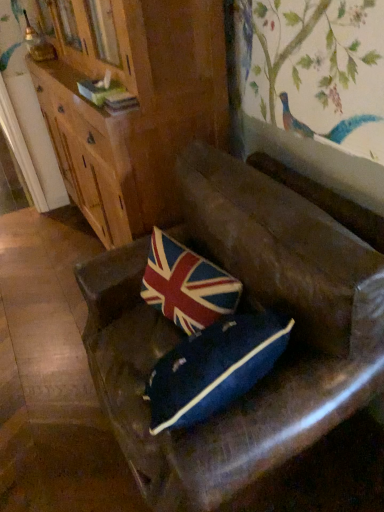
Measure the distance between point (256, 426) and camera.

The depth of point (256, 426) is 37.91 inches.

Where is `wooden cabinet at upper left`? wooden cabinet at upper left is located at coordinates (132, 105).

Measure the distance between wooden cabinet at upper left and camera.

4.21 feet.

Where is `leather couch at center`? The image size is (384, 512). leather couch at center is located at coordinates (243, 309).

Between point (141, 149) and point (283, 305), which one is positioned behind?

The point (141, 149) is more distant.

Is wooden cabinet at upper left bigger than leather couch at center?

Yes.

Is wooden cabinet at upper left in front of leather couch at center?

No, wooden cabinet at upper left is further to the viewer.

Can you see wooden cabinet at upper left touching leather couch at center?

No, wooden cabinet at upper left is not making contact with leather couch at center.

Which object is positioned more to the right, leather couch at center or wooden cabinet at upper left?

leather couch at center is more to the right.

Which object is wider, leather couch at center or wooden cabinet at upper left?

leather couch at center.

Is leather couch at center positioned beyond the bounds of wooden cabinet at upper left?

That's correct, leather couch at center is outside of wooden cabinet at upper left.

Can you confirm if union jack fabric pillow at center is shorter than wooden cabinet at upper left?

Indeed, union jack fabric pillow at center has a lesser height compared to wooden cabinet at upper left.

The width and height of the screenshot is (384, 512). I want to click on cabinetry above the union jack fabric pillow at center (from a real-world perspective), so click(x=132, y=105).

Is union jack fabric pillow at center turned away from wooden cabinet at upper left?

That's not correct — union jack fabric pillow at center is not looking away from wooden cabinet at upper left.

Does union jack fabric pillow at center have a greater height compared to leather couch at center?

No.

Between union jack fabric pillow at center and leather couch at center, which one is positioned in front?

leather couch at center.

Does point (152, 293) come in front of point (377, 317)?

That is False.

Does union jack fabric pillow at center have a larger size compared to leather couch at center?

Incorrect, union jack fabric pillow at center is not larger than leather couch at center.

Considering the sizes of leather couch at center and union jack fabric pillow at center in the image, is leather couch at center taller or shorter than union jack fabric pillow at center?

In the image, leather couch at center appears to be taller than union jack fabric pillow at center.

Is leather couch at center located outside union jack fabric pillow at center?

leather couch at center lies outside union jack fabric pillow at center's area.

Considering the relative sizes of leather couch at center and union jack fabric pillow at center in the image provided, is leather couch at center thinner than union jack fabric pillow at center?

In fact, leather couch at center might be wider than union jack fabric pillow at center.

Is leather couch at center oriented towards union jack fabric pillow at center?

Yes, leather couch at center faces towards union jack fabric pillow at center.

From the image's perspective, which is below, wooden cabinet at upper left or union jack fabric pillow at center?

From the image's view, union jack fabric pillow at center is below.

Does wooden cabinet at upper left touch union jack fabric pillow at center?

No, wooden cabinet at upper left is not with union jack fabric pillow at center.

Is wooden cabinet at upper left behind union jack fabric pillow at center?

That is True.

Find the location of `cabinetry that appears above the leather couch at center (from a real-world perspective)`. cabinetry that appears above the leather couch at center (from a real-world perspective) is located at coordinates (132, 105).

Locate an element on the screen. furniture beneath the wooden cabinet at upper left (from a real-world perspective) is located at coordinates (243, 309).

Estimate the real-world distances between objects in this image. Which object is further from leather couch at center, wooden cabinet at upper left or union jack fabric pillow at center?

Among the two, wooden cabinet at upper left is located further to leather couch at center.

From the image, which object appears to be farther from union jack fabric pillow at center, wooden cabinet at upper left or leather couch at center?

wooden cabinet at upper left.

Considering their positions, is leather couch at center positioned closer to union jack fabric pillow at center than wooden cabinet at upper left?

The object closer to union jack fabric pillow at center is leather couch at center.

Based on their spatial positions, is leather couch at center or union jack fabric pillow at center closer to wooden cabinet at upper left?

union jack fabric pillow at center lies closer to wooden cabinet at upper left than the other object.

From the image, which object appears to be farther from wooden cabinet at upper left, union jack fabric pillow at center or leather couch at center?

leather couch at center.

Which object lies further to the anchor point leather couch at center, union jack fabric pillow at center or wooden cabinet at upper left?

wooden cabinet at upper left is positioned further to the anchor leather couch at center.

Find the location of a particular element. The image size is (384, 512). pillow between wooden cabinet at upper left and leather couch at center in the up-down direction is located at coordinates [x=187, y=285].